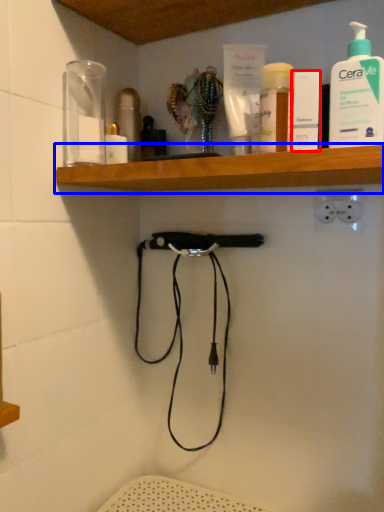
Question: Which of the following is the farthest to the observer, toiletry (highlighted by a red box) or shelf (highlighted by a blue box)?

Choices:
 (A) toiletry
 (B) shelf

Answer: (A)